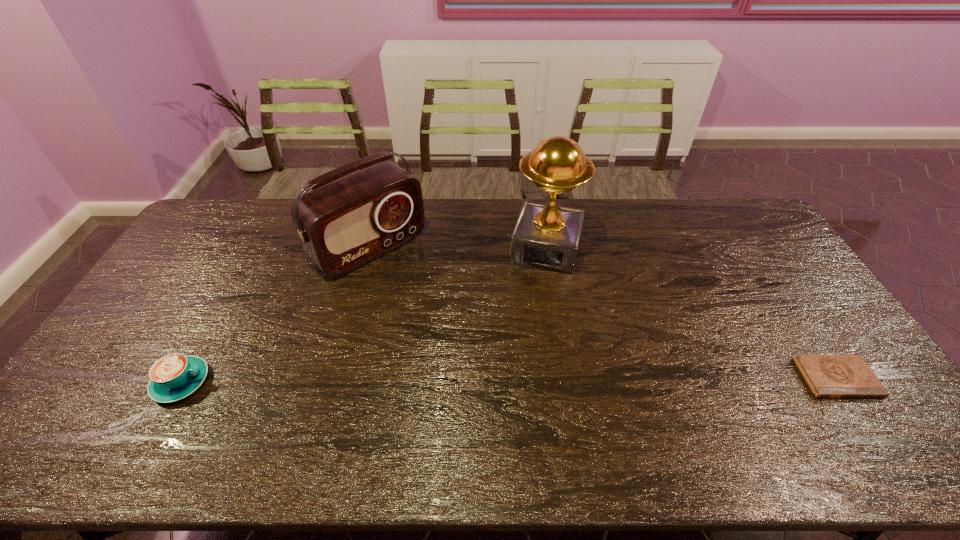
The height and width of the screenshot is (540, 960). What are the coordinates of `free point between the diary and the leftmost object` in the screenshot? It's located at (509, 380).

Find the location of a particular element. Image resolution: width=960 pixels, height=540 pixels. empty space that is in between the tallest object and the second object from left to right is located at coordinates (458, 248).

Where is `vacant point located between the radio receiver and the shortest object`? This screenshot has width=960, height=540. vacant point located between the radio receiver and the shortest object is located at coordinates (603, 313).

This screenshot has width=960, height=540. I want to click on free space between the third object from left to right and the diary, so click(691, 313).

Find the location of a particular element. vacant area that lies between the leftmost object and the shortest object is located at coordinates (509, 380).

Choose which object is the second nearest neighbor to the leftmost object. Please provide its 2D coordinates. Your answer should be formatted as a tuple, i.e. [(x, y)], where the tuple contains the x and y coordinates of a point satisfying the conditions above.

[(546, 236)]

Identify the location of object that ranks as the third closest to the radio receiver. The height and width of the screenshot is (540, 960). (828, 376).

Image resolution: width=960 pixels, height=540 pixels. I want to click on free space that satisfies the following two spatial constraints: 1. on the front side of the tallest object; 2. on the left side of the radio receiver, so click(370, 248).